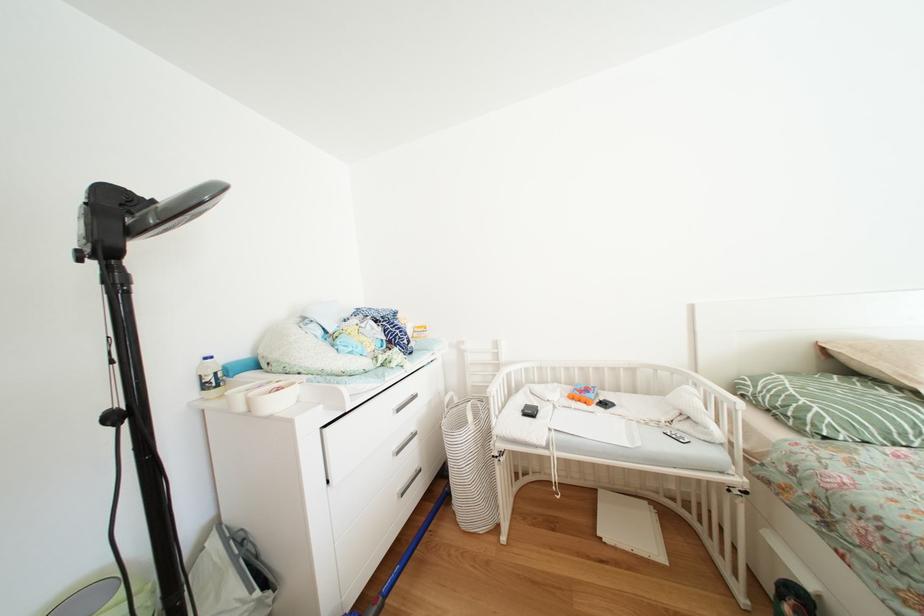
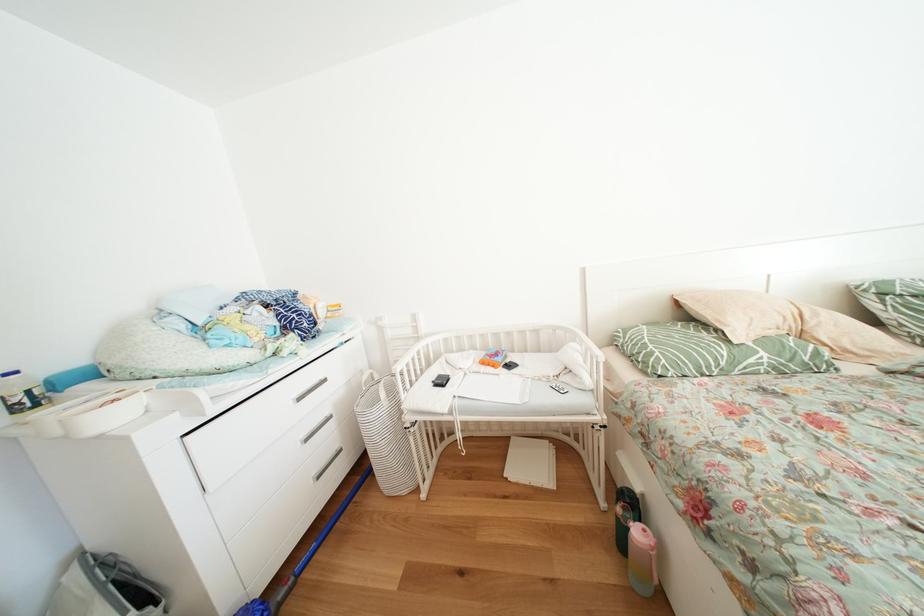
Question: The first image is from the beginning of the video and the second image is from the end. How did the camera likely rotate when shooting the video?

Choices:
 (A) Left
 (B) Right
 (C) Up
 (D) Down

Answer: (B)